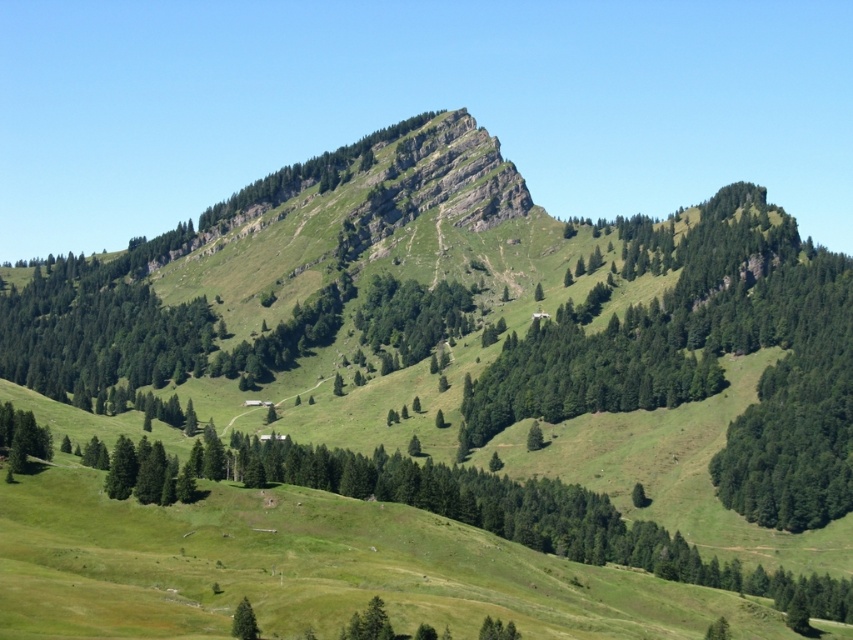
Question: Which point is closer to the camera?

Choices:
 (A) (258, 630)
 (B) (466, 324)

Answer: (A)

Question: Is the position of green textured tree at left less distant than that of green matte tree at lower center?

Choices:
 (A) no
 (B) yes

Answer: (A)

Question: Among these objects, which one is farthest from the camera?

Choices:
 (A) green textured tree at left
 (B) green matte tree at lower center

Answer: (A)

Question: Is green leafy tree at center above green matte tree at lower center?

Choices:
 (A) yes
 (B) no

Answer: (A)

Question: Can you confirm if green textured tree at left is bigger than green matte tree at lower center?

Choices:
 (A) yes
 (B) no

Answer: (A)

Question: Which point is farther to the camera?

Choices:
 (A) green textured tree at left
 (B) green leafy tree at center

Answer: (B)